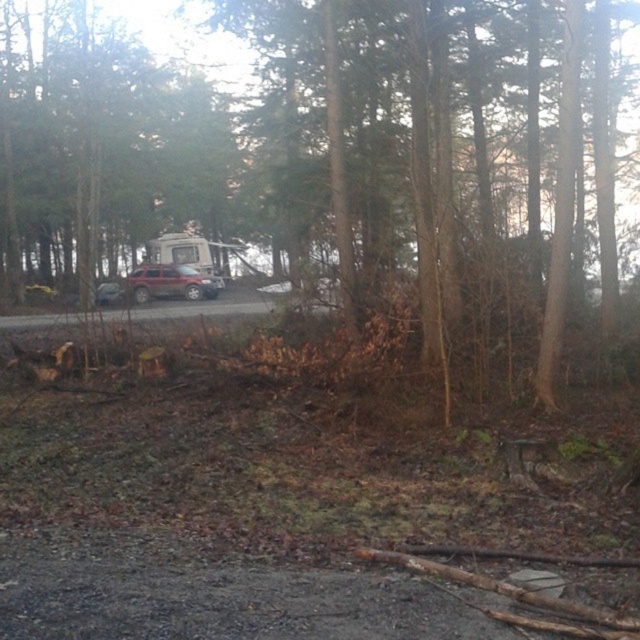
Question: Based on their relative distances, which object is farther from the satin silver suv at center?

Choices:
 (A) rustic metallic jeep at center
 (B) brown rough tree trunk at center

Answer: (B)

Question: Is white glossy recreational vehicle at center positioned before satin silver suv at center?

Choices:
 (A) no
 (B) yes

Answer: (A)

Question: Among these points, which one is farthest from the camera?

Choices:
 (A) (120, 289)
 (B) (157, 292)
 (C) (24, 172)

Answer: (B)

Question: Estimate the real-world distances between objects in this image. Which object is closer to the satin silver suv at center?

Choices:
 (A) brown rough tree trunk at center
 (B) rustic metallic jeep at center

Answer: (B)

Question: Is the position of white glossy recreational vehicle at center less distant than that of satin silver suv at center?

Choices:
 (A) no
 (B) yes

Answer: (A)

Question: Does brown rough tree trunk at center have a lesser width compared to white glossy recreational vehicle at center?

Choices:
 (A) no
 (B) yes

Answer: (A)